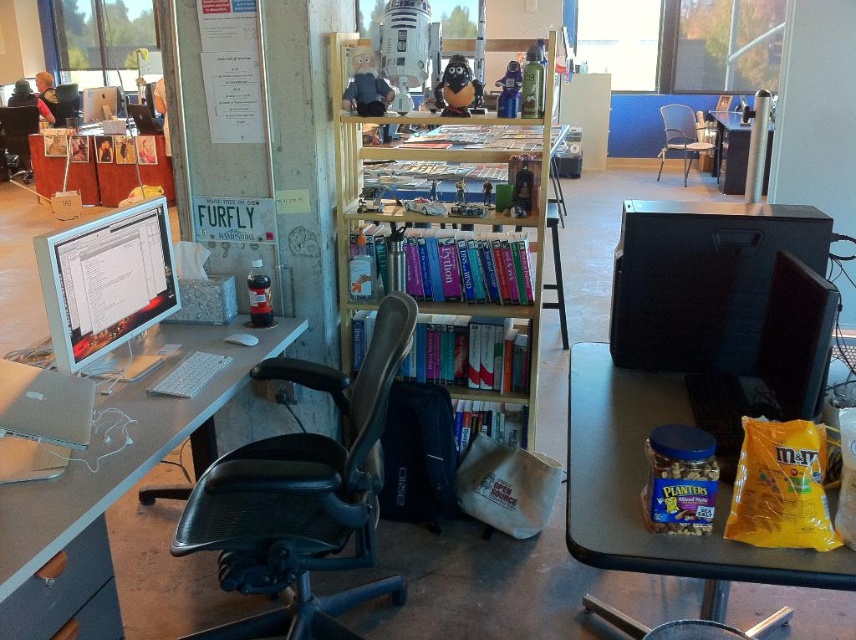
Does wooden bookshelf at center come in front of satin silver monitor at left?

No, wooden bookshelf at center is behind satin silver monitor at left.

Which is behind, point (452, 330) or point (64, 301)?

Point (452, 330)

In order to click on wooden bookshelf at center in this screenshot , I will do pos(459,292).

Is black leather swivel chair at center wider than white paperboard at upper left?

Yes, black leather swivel chair at center is wider than white paperboard at upper left.

Which is in front, point (399, 586) or point (171, 96)?

Point (399, 586) is in front.

Who is more distant from viewer, (376,344) or (218,150)?

Point (218,150)

Locate an element on the screen. black leather swivel chair at center is located at coordinates tap(301, 497).

Does point (209, 515) come in front of point (584, 541)?

No, it is behind (584, 541).

Is black leather swivel chair at center wider than matte plastic computer desk at right?

Yes, black leather swivel chair at center is wider than matte plastic computer desk at right.

What are the coordinates of `black leather swivel chair at center` in the screenshot? It's located at (301, 497).

Where is `black leather swivel chair at center`? black leather swivel chair at center is located at coordinates (301, 497).